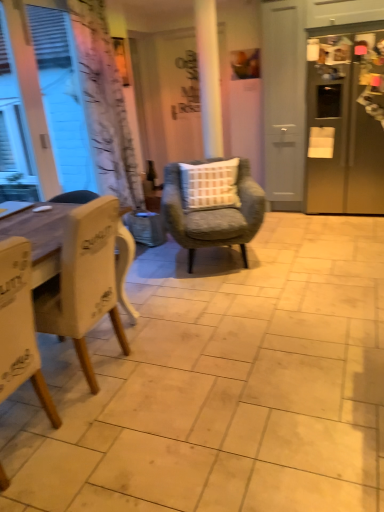
Image resolution: width=384 pixels, height=512 pixels. In order to click on free point below white wood chair at left, which is counted as the third chair, starting from the back (from a real-world perspective) in this screenshot , I will do `click(24, 440)`.